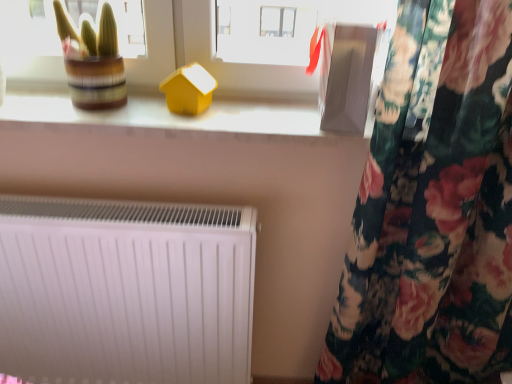
Find the location of a particular element. This screenshot has height=384, width=512. free spot above matte yellow house at upper center (from a real-world perspective) is located at coordinates (178, 109).